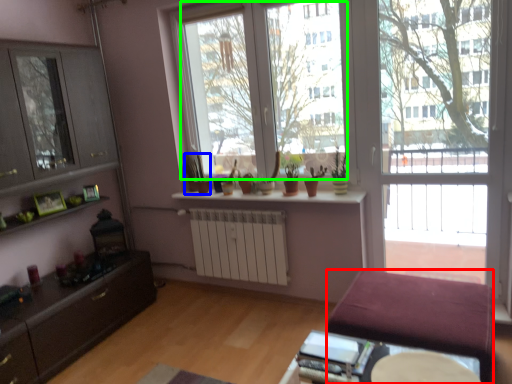
Question: Estimate the real-world distances between objects in this image. Which object is farther from studio couch (highlighted by a red box), houseplant (highlighted by a blue box) or window screen (highlighted by a green box)?

Choices:
 (A) houseplant
 (B) window screen

Answer: (A)